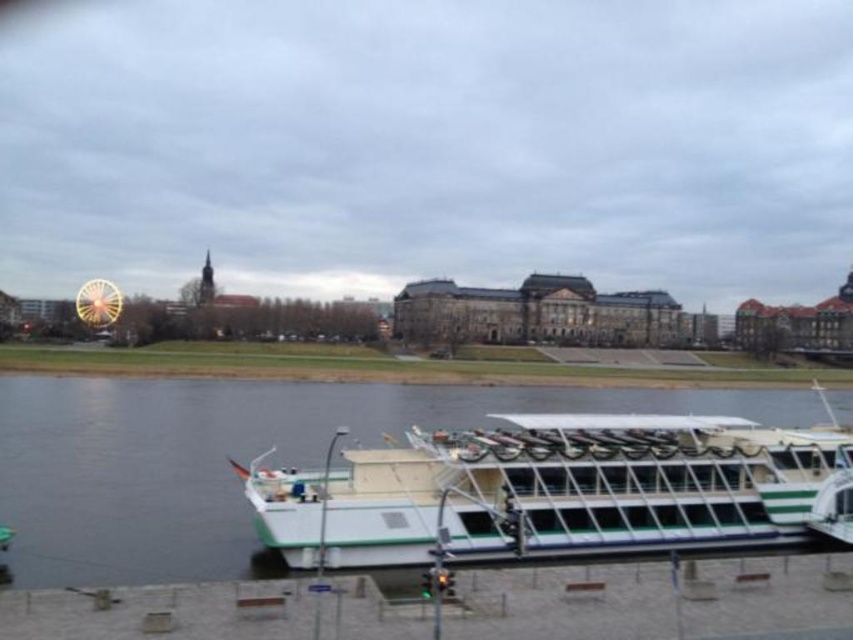
Does white matte boat at lower center have a smaller size compared to shiny yellow ferris wheel at left?

Correct, white matte boat at lower center occupies less space than shiny yellow ferris wheel at left.

Which is behind, point (703, 444) or point (201, 352)?

Point (201, 352)

Is point (531, 424) behind point (532, 348)?

No, it is in front of (532, 348).

Locate an element on the screen. The width and height of the screenshot is (853, 640). white matte boat at lower center is located at coordinates (560, 490).